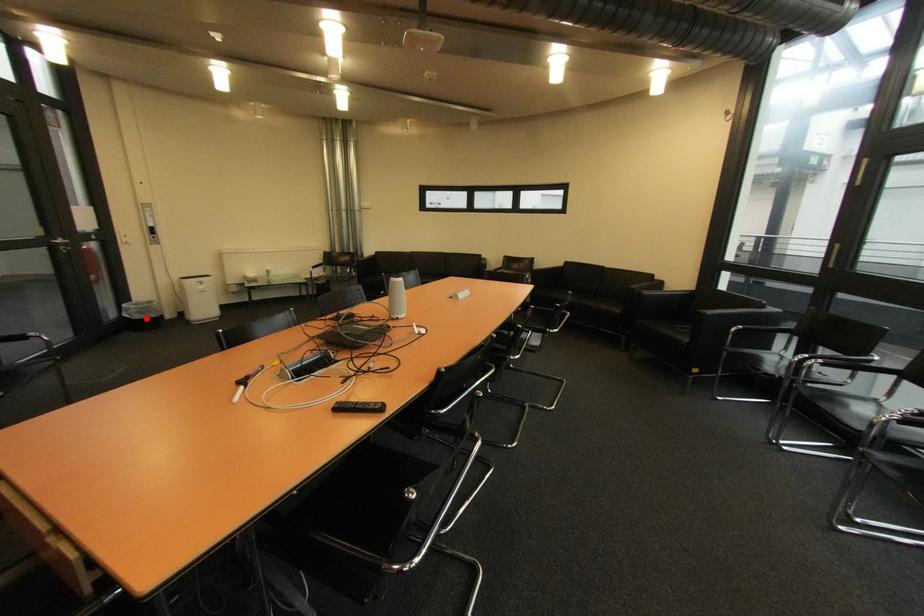
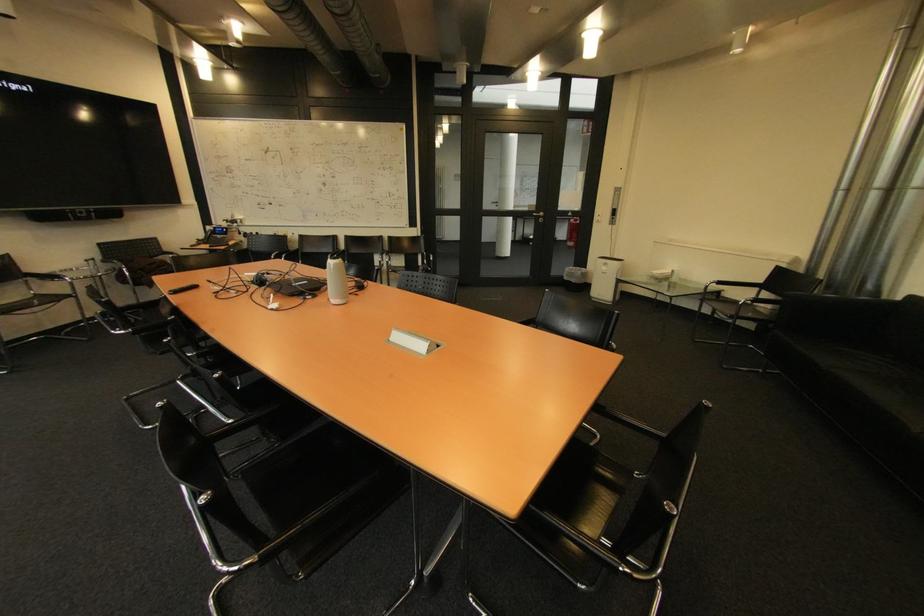
Where in the second image is the point corresponding to the highlighted location from the first image?

(574, 280)